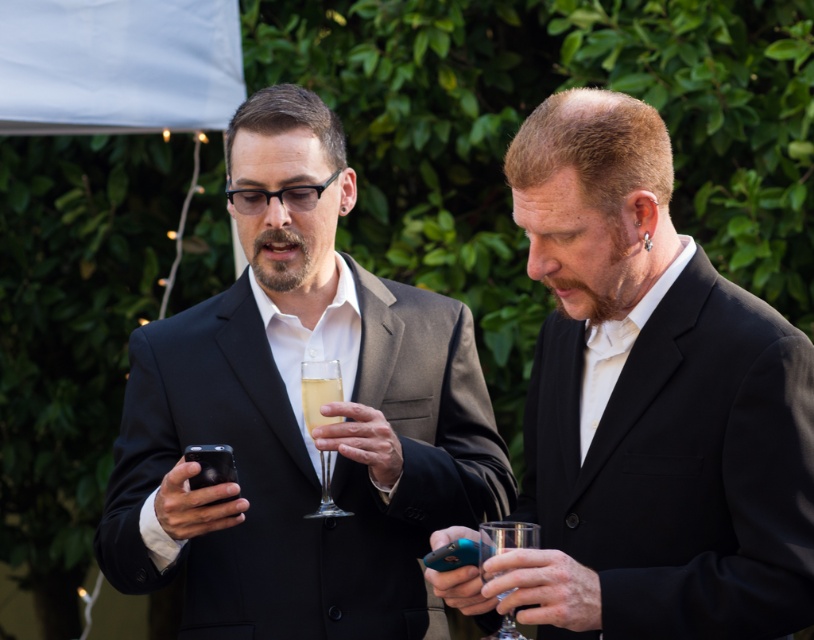
You are a photographer at an event and need to capture a photo of the matte black suit at right and the clear crystal wine glass at center. To ensure both are in focus, you must adjust your camera settings. Considering their positions, which object should be closer to the camera?

The matte black suit at right is in front of the clear crystal wine glass at center, so the matte black suit at right is closer to the camera.

You are a photographer at the event and need to position a backdrop between the matte black suit at center and the clear crystal wine glass at center. Which object should the backdrop be placed closer to to ensure it fits within the frame?

The backdrop should be placed closer to the clear crystal wine glass at center because the matte black suit at center is wider than the clear crystal wine glass at center, requiring more space on its side.

You are standing at the point with coordinates point (338, 394) and want to take a photo of the point at point (607, 627). Which direction should you move to get a better shot?

You should move towards the point (607, 627) because it is closer to the camera, so moving towards it will allow you to capture it more clearly in your photo.